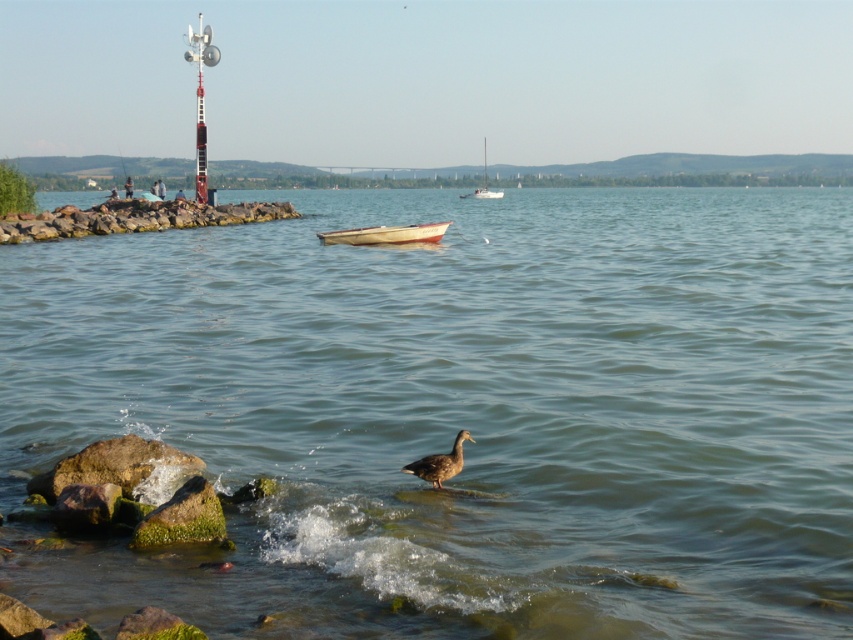
You are a photographer aiming to capture the brown matte duck at center and the white matte boat at center in the same frame. Based on their positions, which object should appear closer to the camera in your photo?

The white matte boat at center appears closer to the camera than the brown matte duck at center because the brown matte duck at center is positioned behind the white matte boat at center.

You are standing at the lakeside and want to throw a pebble to reach the white matte boat at center. Given that the pebble can travel up to 35 meters, will it be possible?

The white matte boat at center is 37.26 meters away from the camera, so the pebble cannot reach it as it exceeds the 35 meters range.

You are standing at the lakeside and see the white matte boat at center and the white sailboat at center. If you want to throw a pebble to hit both boats, which boat should you aim for first, the closer one or the farther one?

The white matte boat at center is 72.51 meters away from the white sailboat at center. Since you want to hit both boats with a single pebble, you should aim for the closer one first. However, without knowing the exact distance from your position to each boat, it is impossible to determine which boat is closer or farther from you. The question cannot be answered with the provided information.